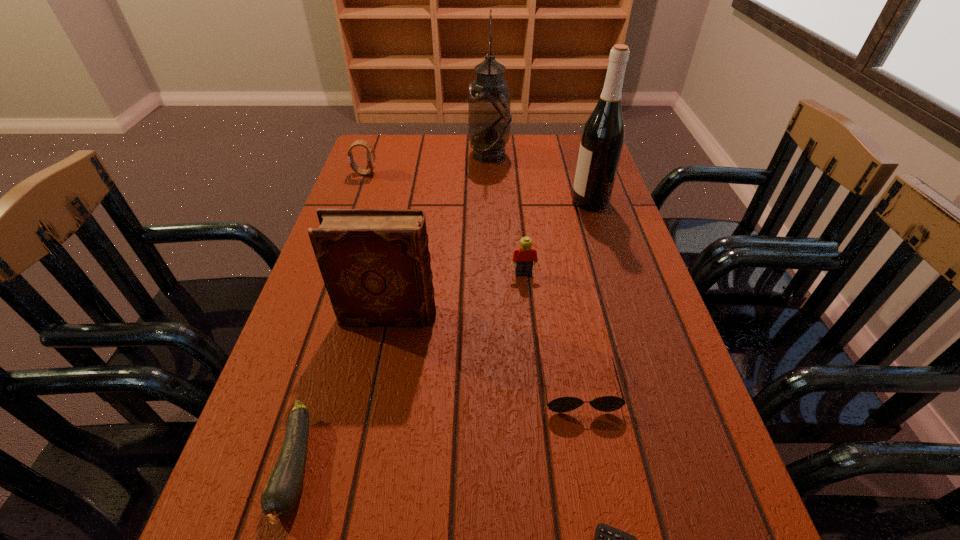
The height and width of the screenshot is (540, 960). Identify the location of free space between the zucchini and the Lego. (410, 370).

What are the coordinates of `vacant area that lies between the watch and the zucchini` in the screenshot? It's located at (330, 320).

In order to click on vacant space that's between the sunglasses and the watch in this screenshot , I will do `click(471, 281)`.

The image size is (960, 540). Identify the location of empty space that is in between the sunglasses and the wine bottle. (585, 295).

You are a GUI agent. You are given a task and a screenshot of the screen. Output one action in this format:
    pyautogui.click(x=<x>, y=<y>)
    Task: Click on the free area in between the second farthest object and the oil lamp
    
    Given the screenshot: What is the action you would take?
    pyautogui.click(x=427, y=164)

The image size is (960, 540). In order to click on free point between the fifth nearest object and the fifth farthest object in this screenshot , I will do `click(456, 295)`.

You are a GUI agent. You are given a task and a screenshot of the screen. Output one action in this format:
    pyautogui.click(x=<x>, y=<y>)
    Task: Click on the vacant point located between the fifth nearest object and the watch
    
    Given the screenshot: What is the action you would take?
    pyautogui.click(x=444, y=224)

Locate an element on the screen. The height and width of the screenshot is (540, 960). free space between the Lego and the sunglasses is located at coordinates (551, 331).

Where is `vacant area between the fifth nearest object and the zucchini`? This screenshot has height=540, width=960. vacant area between the fifth nearest object and the zucchini is located at coordinates (410, 370).

Locate an element on the screen. Image resolution: width=960 pixels, height=540 pixels. object that is the seventh closest one to the oil lamp is located at coordinates (607, 539).